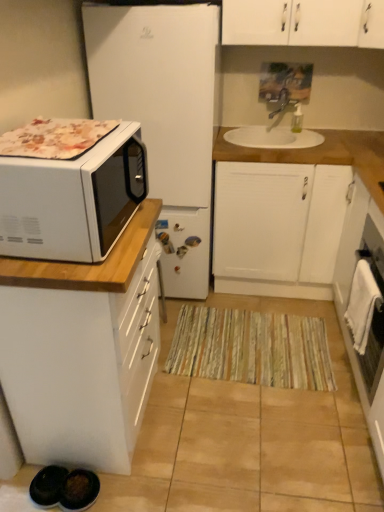
Question: From a real-world perspective, does white ceramic sink at upper center stand above white glossy microwave at left?

Choices:
 (A) yes
 (B) no

Answer: (B)

Question: Can you confirm if white ceramic sink at upper center is shorter than white glossy microwave at left?

Choices:
 (A) yes
 (B) no

Answer: (A)

Question: From a real-world perspective, is white ceramic sink at upper center below white glossy microwave at left?

Choices:
 (A) yes
 (B) no

Answer: (A)

Question: Is white ceramic sink at upper center facing towards white glossy microwave at left?

Choices:
 (A) yes
 (B) no

Answer: (A)

Question: Considering the relative positions of white ceramic sink at upper center and white glossy microwave at left in the image provided, is white ceramic sink at upper center to the left of white glossy microwave at left from the viewer's perspective?

Choices:
 (A) yes
 (B) no

Answer: (B)

Question: Can you confirm if white ceramic sink at upper center is taller than white glossy microwave at left?

Choices:
 (A) no
 (B) yes

Answer: (A)

Question: From the image's perspective, does white glossy microwave at left, placed as the second cabinetry when sorted from back to front, appear lower than white matte refrigerator at left?

Choices:
 (A) no
 (B) yes

Answer: (B)

Question: Can you confirm if white glossy microwave at left, which is the second cabinetry in right-to-left order, is taller than white matte refrigerator at left?

Choices:
 (A) no
 (B) yes

Answer: (A)

Question: From the image's perspective, does white glossy microwave at left, positioned as the 1th cabinetry in left-to-right order, appear higher than white matte refrigerator at left?

Choices:
 (A) yes
 (B) no

Answer: (B)

Question: Considering the relative positions of white glossy microwave at left, which is the second cabinetry in right-to-left order, and white matte refrigerator at left in the image provided, is white glossy microwave at left, which is the second cabinetry in right-to-left order, to the right of white matte refrigerator at left from the viewer's perspective?

Choices:
 (A) yes
 (B) no

Answer: (B)

Question: Does white glossy microwave at left, the 1th cabinetry when ordered from front to back, have a smaller size compared to white matte refrigerator at left?

Choices:
 (A) no
 (B) yes

Answer: (B)

Question: Is white matte refrigerator at left a part of white glossy microwave at left, the 1th cabinetry when ordered from front to back?

Choices:
 (A) yes
 (B) no

Answer: (B)

Question: Is white glossy oven at right at the right side of white matte refrigerator at left?

Choices:
 (A) no
 (B) yes

Answer: (B)